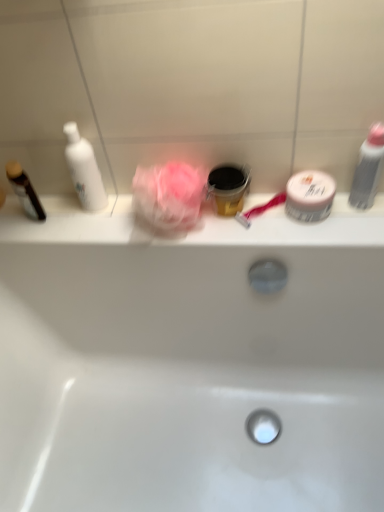
Image resolution: width=384 pixels, height=512 pixels. In order to click on free area in between dark brown glossy bottle at left, which is the 1th toiletry from left to right, and pink fabric rose at center in this screenshot , I will do `click(86, 220)`.